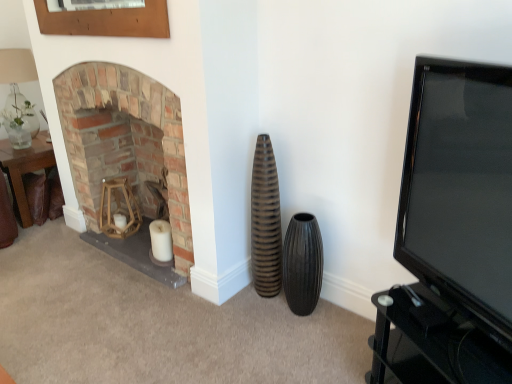
Describe the element at coordinates (106, 21) in the screenshot. This screenshot has height=384, width=512. I see `wooden frame at upper left` at that location.

Image resolution: width=512 pixels, height=384 pixels. What are the coordinates of `black glossy tv at right` in the screenshot? It's located at (460, 190).

I want to click on brick fireplace at left, so click(125, 142).

The width and height of the screenshot is (512, 384). What are the coordinates of `wooden frame at upper left` in the screenshot? It's located at (106, 21).

Which of these two, brown leather table at left or translucent glass vase at upper left, is wider?

With larger width is brown leather table at left.

How different are the orientations of brown leather table at left and translucent glass vase at upper left in degrees?

The facing directions of brown leather table at left and translucent glass vase at upper left are 0.443 degrees apart.

Is brown leather table at left taller than translucent glass vase at upper left?

No, brown leather table at left is not taller than translucent glass vase at upper left.

From the image's perspective, which one is positioned lower, brown leather table at left or translucent glass vase at upper left?

brown leather table at left, from the image's perspective.

From the image's perspective, who appears lower, black glossy tv at right or translucent glass vase at upper left?

black glossy tv at right is shown below in the image.

In order to click on television in front of the translucent glass vase at upper left in this screenshot , I will do `click(460, 190)`.

Is black glossy tv at right in front of or behind translucent glass vase at upper left in the image?

Clearly, black glossy tv at right is in front of translucent glass vase at upper left.

Can you tell me how much black glossy tv at right and translucent glass vase at upper left differ in facing direction?

The angle between the facing direction of black glossy tv at right and the facing direction of translucent glass vase at upper left is 117 degrees.

From a real-world perspective, is brown leather table at left above or below black glossy tv at right?

Clearly, from a real-world perspective, brown leather table at left is below black glossy tv at right.

From the image's perspective, between brown leather table at left and black glossy tv at right, which one is located above?

brown leather table at left is shown above in the image.

Identify the location of television in front of the brown leather table at left. The image size is (512, 384). (460, 190).

Is brown leather table at left not within black glossy tv at right?

That's correct, brown leather table at left is outside of black glossy tv at right.

Would you consider wooden frame at upper left to be distant from black glossy tv at right?

Yes, wooden frame at upper left and black glossy tv at right are located far from each other.

Looking at this image, would you say wooden frame at upper left contains black glossy tv at right?

No.

Between wooden frame at upper left and black glossy tv at right, which one has smaller size?

With smaller size is wooden frame at upper left.

Considering the sizes of objects wooden frame at upper left and black glossy tv at right in the image provided, who is wider, wooden frame at upper left or black glossy tv at right?

Wider between the two is black glossy tv at right.

Is brick fireplace at left oriented towards translucent glass vase at upper left?

No, brick fireplace at left does not turn towards translucent glass vase at upper left.

Which object is more forward, brick fireplace at left or translucent glass vase at upper left?

brick fireplace at left.

From the image's perspective, is brick fireplace at left located above or below translucent glass vase at upper left?

From the image's perspective, brick fireplace at left appears below translucent glass vase at upper left.

Considering the sizes of brick fireplace at left and translucent glass vase at upper left in the image, is brick fireplace at left wider or thinner than translucent glass vase at upper left?

Clearly, brick fireplace at left has more width compared to translucent glass vase at upper left.

From the picture: Which of these two, translucent glass vase at upper left or black glossy tv at right, stands shorter?

Standing shorter between the two is translucent glass vase at upper left.

Are translucent glass vase at upper left and black glossy tv at right located far from each other?

Yes, translucent glass vase at upper left and black glossy tv at right are quite far apart.

Which object is closer to the camera, translucent glass vase at upper left or black glossy tv at right?

black glossy tv at right is more forward.

From the image's perspective, between black glossy tv at right and brown ribbed vase at center, which is counted as the 2th vase, starting from the right, which one is located above?

From the image's view, black glossy tv at right is above.

How much distance is there between black glossy tv at right and brown ribbed vase at center, which is the 1th vase from left to right?

black glossy tv at right is 34.56 inches away from brown ribbed vase at center, which is the 1th vase from left to right.

Considering the sizes of objects black glossy tv at right and brown ribbed vase at center, which is the 1th vase from left to right, in the image provided, who is taller, black glossy tv at right or brown ribbed vase at center, which is the 1th vase from left to right,?

Standing taller between the two is brown ribbed vase at center, which is the 1th vase from left to right.

From a real-world perspective, which object stands above the other?

In real-world perspective, black glossy tv at right is above.

Locate an element on the screen. The image size is (512, 384). table located on the right of translucent glass vase at upper left is located at coordinates (25, 171).

The image size is (512, 384). In order to click on television in front of the translucent glass vase at upper left in this screenshot , I will do `click(460, 190)`.

Estimate the real-world distances between objects in this image. Which object is further from black ribbed vase at center, the 1th vase in the right-to-left sequence, brown ribbed vase at center, which is counted as the 2th vase, starting from the right, or wooden frame at upper left?

The object further to black ribbed vase at center, the 1th vase in the right-to-left sequence, is wooden frame at upper left.

Considering their positions, is brick fireplace at left positioned closer to black ribbed vase at center, the 1th vase in the right-to-left sequence, than brown leather table at left?

Answer: brick fireplace at left is positioned closer to the anchor black ribbed vase at center, the 1th vase in the right-to-left sequence.

Based on their spatial positions, is brick fireplace at left or translucent glass vase at upper left closer to black ribbed vase at center, the second vase when ordered from left to right?

The object closer to black ribbed vase at center, the second vase when ordered from left to right, is brick fireplace at left.

Based on their spatial positions, is black glossy tv at right or brick fireplace at left further from wooden frame at upper left?

black glossy tv at right.

Estimate the real-world distances between objects in this image. Which object is closer to translucent glass vase at upper left, black glossy tv at right or brown ribbed vase at center, which is counted as the 2th vase, starting from the right?

brown ribbed vase at center, which is counted as the 2th vase, starting from the right.

Based on their spatial positions, is black ribbed vase at center, the second vase when ordered from left to right, or black glossy tv at right further from brown ribbed vase at center, which is the 1th vase from left to right?

black glossy tv at right is further to brown ribbed vase at center, which is the 1th vase from left to right.

Considering their positions, is translucent glass vase at upper left positioned further to brown leather table at left than black glossy tv at right?

black glossy tv at right is further to brown leather table at left.

Which object lies further to the anchor point brick fireplace at left, wooden frame at upper left or black ribbed vase at center, the second vase when ordered from left to right?

The object further to brick fireplace at left is black ribbed vase at center, the second vase when ordered from left to right.

The image size is (512, 384). In order to click on vase between brown leather table at left and black ribbed vase at center, the second vase when ordered from left to right in this screenshot , I will do `click(265, 221)`.

Find the location of a particular element. Image resolution: width=512 pixels, height=384 pixels. vase between brick fireplace at left and black ribbed vase at center, the second vase when ordered from left to right is located at coordinates (265, 221).

Locate an element on the screen. This screenshot has height=384, width=512. fireplace situated between translucent glass vase at upper left and black glossy tv at right from left to right is located at coordinates (125, 142).

Locate an element on the screen. picture frame between translucent glass vase at upper left and brick fireplace at left in the horizontal direction is located at coordinates (106, 21).